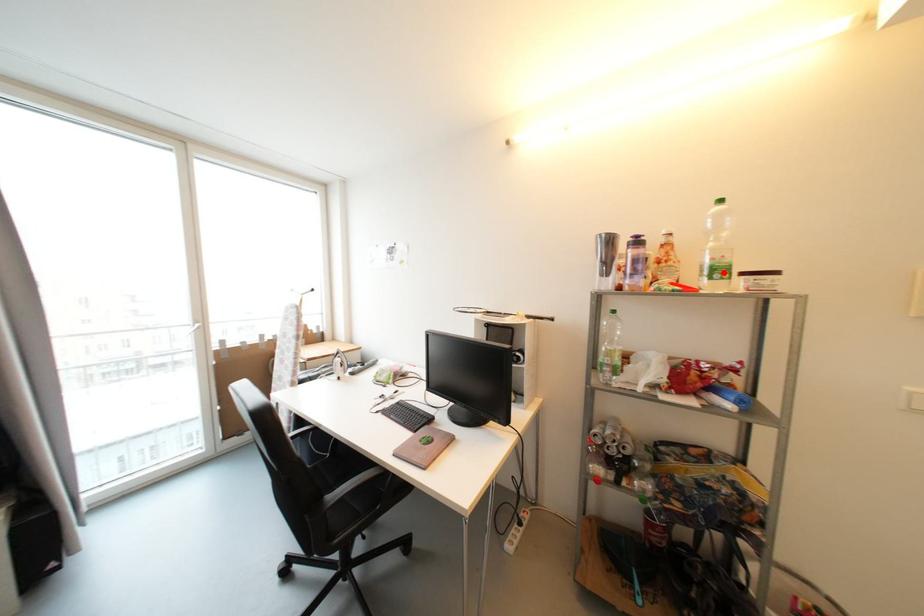
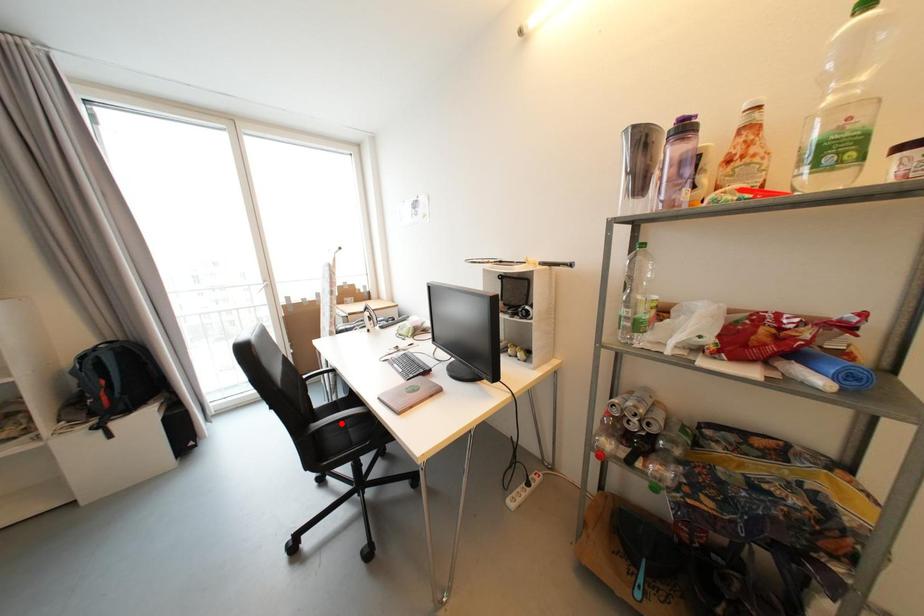
I am providing you with two images of the same scene from different viewpoints. A red point is marked on the first image and another point is marked on the second image. Does the point marked in image1 correspond to the same location as the one in image2?

No